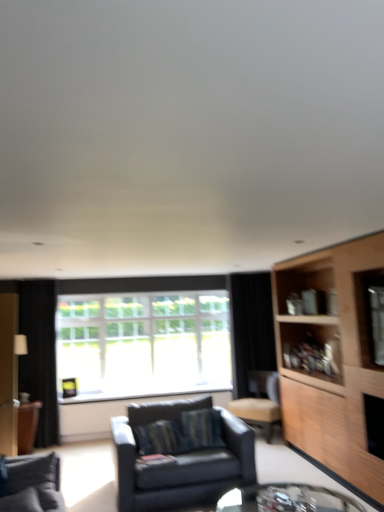
Question: Should I look upward or downward to see leather-like beige chair at center-right?

Choices:
 (A) down
 (B) up

Answer: (A)

Question: Can you confirm if dark gray fabric couch at lower left, the first studio couch from the front, is wider than black fabric curtain at right, placed as the first curtain when sorted from back to front?

Choices:
 (A) yes
 (B) no

Answer: (A)

Question: Is dark gray fabric couch at lower left, the second studio couch viewed from the back, positioned beyond the bounds of black fabric curtain at right, which is the second curtain in left-to-right order?

Choices:
 (A) yes
 (B) no

Answer: (A)

Question: Considering the relative positions of dark gray fabric couch at lower left, which appears as the second studio couch when viewed from the right, and black fabric curtain at right, the 1th curtain from the right, in the image provided, is dark gray fabric couch at lower left, which appears as the second studio couch when viewed from the right, to the right of black fabric curtain at right, the 1th curtain from the right, from the viewer's perspective?

Choices:
 (A) yes
 (B) no

Answer: (B)

Question: Is dark gray fabric couch at lower left, which appears as the second studio couch when viewed from the right, far away from black fabric curtain at right, placed as the first curtain when sorted from back to front?

Choices:
 (A) no
 (B) yes

Answer: (B)

Question: Considering the relative sizes of dark gray fabric couch at lower left, the second studio couch viewed from the back, and black fabric curtain at right, placed as the first curtain when sorted from back to front, in the image provided, is dark gray fabric couch at lower left, the second studio couch viewed from the back, bigger than black fabric curtain at right, placed as the first curtain when sorted from back to front,?

Choices:
 (A) yes
 (B) no

Answer: (B)

Question: From a real-world perspective, is dark gray fabric couch at lower left, the second studio couch viewed from the back, under black fabric curtain at right, placed as the first curtain when sorted from back to front?

Choices:
 (A) yes
 (B) no

Answer: (A)

Question: Considering the relative sizes of matte black couch at center, which appears as the 2th studio couch when viewed from the front, and leather-like beige chair at center-right in the image provided, is matte black couch at center, which appears as the 2th studio couch when viewed from the front, bigger than leather-like beige chair at center-right?

Choices:
 (A) yes
 (B) no

Answer: (A)

Question: Can you confirm if matte black couch at center, the first studio couch in the right-to-left sequence, is positioned to the right of leather-like beige chair at center-right?

Choices:
 (A) no
 (B) yes

Answer: (A)

Question: Is matte black couch at center, which appears as the 2th studio couch when viewed from the front, far from leather-like beige chair at center-right?

Choices:
 (A) yes
 (B) no

Answer: (A)

Question: From a real-world perspective, is matte black couch at center, the first studio couch when ordered from back to front, physically above leather-like beige chair at center-right?

Choices:
 (A) no
 (B) yes

Answer: (A)

Question: Does matte black couch at center, the first studio couch when ordered from back to front, turn towards leather-like beige chair at center-right?

Choices:
 (A) yes
 (B) no

Answer: (B)

Question: From the image's perspective, is matte black couch at center, the first studio couch when ordered from back to front, on top of leather-like beige chair at center-right?

Choices:
 (A) no
 (B) yes

Answer: (B)

Question: Can you confirm if clear glass table at lower center is smaller than dark gray fabric couch at lower left, the first studio couch from the front?

Choices:
 (A) no
 (B) yes

Answer: (B)